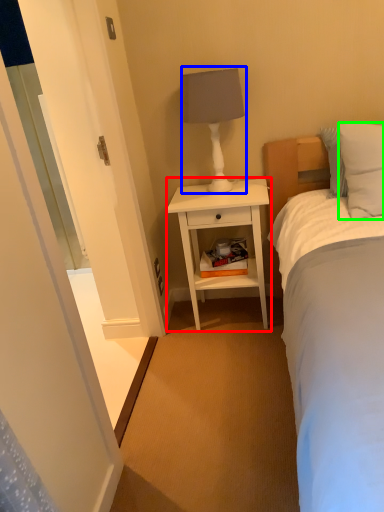
Question: Which is farther away from nightstand (highlighted by a red box)? table lamp (highlighted by a blue box) or pillow (highlighted by a green box)?

Choices:
 (A) table lamp
 (B) pillow

Answer: (B)